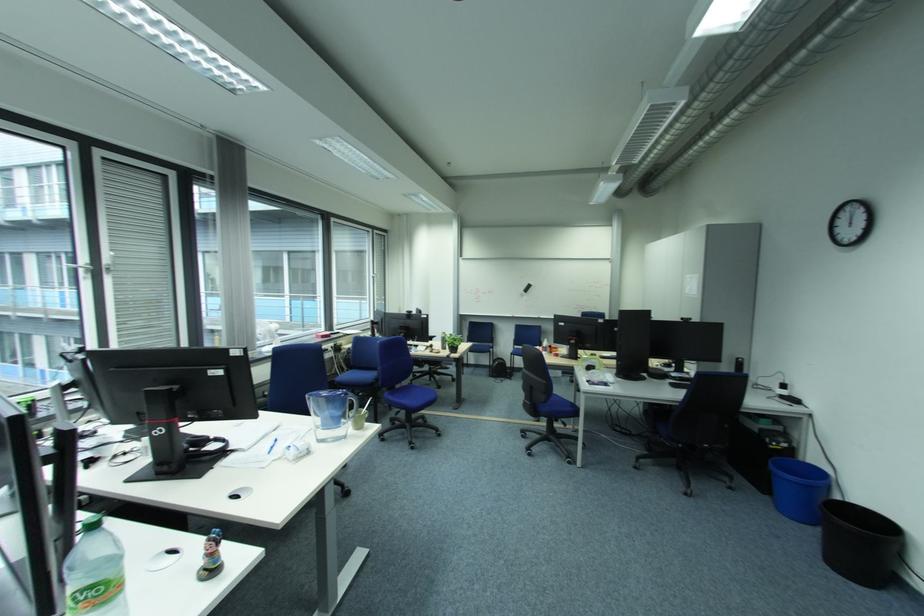
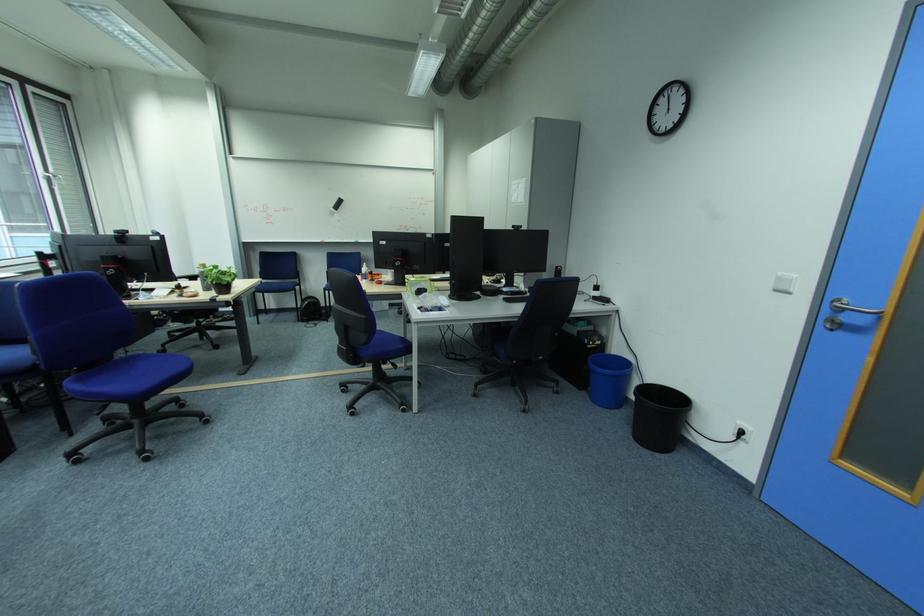
Find the pixel in the second image that matches point 775,496 in the first image.

(592, 392)